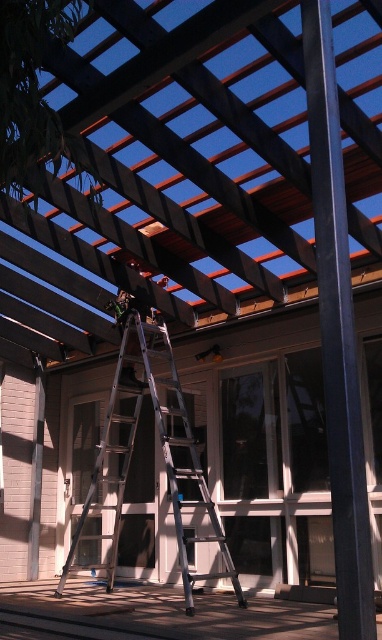
Question: Observing the image, what is the correct spatial positioning of wooden deck at lower center in reference to silver metallic ladder at center?

Choices:
 (A) above
 (B) below

Answer: (B)

Question: Which object appears closest to the camera in this image?

Choices:
 (A) wooden deck at lower center
 (B) dark brown wooden beams at center
 (C) silver metallic ladder at center

Answer: (B)

Question: Which point is closer to the camera?

Choices:
 (A) (344, 13)
 (B) (192, 433)
 (C) (116, 614)

Answer: (A)

Question: Can you confirm if wooden deck at lower center is positioned above silver metallic ladder at center?

Choices:
 (A) no
 (B) yes

Answer: (A)

Question: Which object is positioned farthest from the wooden deck at lower center?

Choices:
 (A) dark brown wooden beams at center
 (B) silver metallic ladder at center

Answer: (A)

Question: In this image, where is wooden deck at lower center located relative to silver metallic ladder at center?

Choices:
 (A) above
 (B) below

Answer: (B)